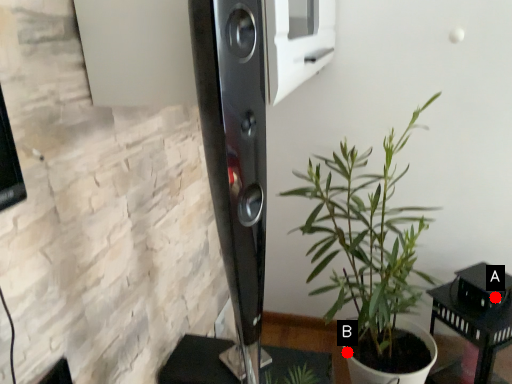
Question: Two points are circled on the image, labeled by A and B beside each circle. Which of the following is the closest to the observer?

Choices:
 (A) A is closer
 (B) B is closer

Answer: (A)